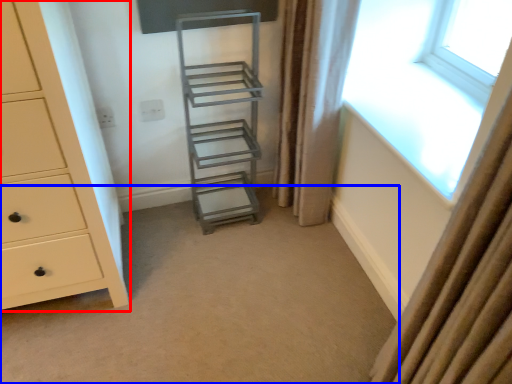
Question: Which object appears farthest to the camera in this image, chest of drawers (highlighted by a red box) or plain (highlighted by a blue box)?

Choices:
 (A) chest of drawers
 (B) plain

Answer: (B)